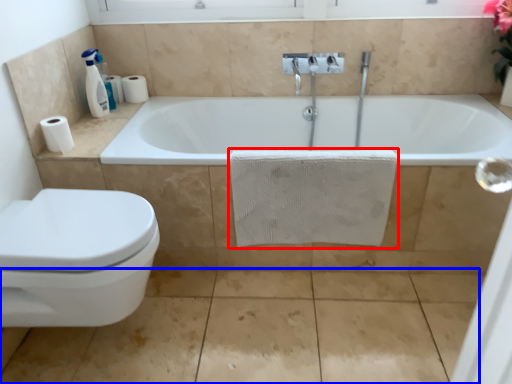
Question: Which of the following is the closest to the observer, bath towel (highlighted by a red box) or concrete (highlighted by a blue box)?

Choices:
 (A) bath towel
 (B) concrete

Answer: (B)